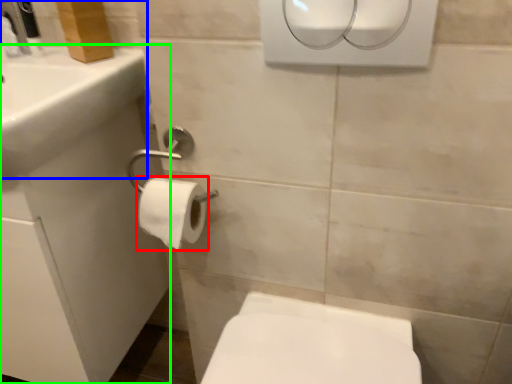
Question: Which object is the farthest from toilet paper (highlighted by a red box)? Choose among these: sink (highlighted by a blue box) or porcelain (highlighted by a green box).

Choices:
 (A) sink
 (B) porcelain

Answer: (B)